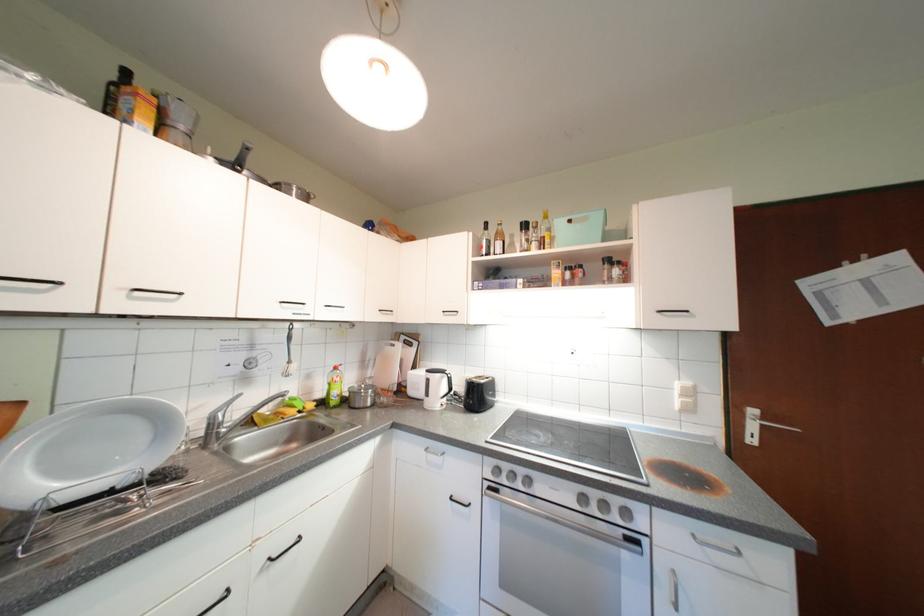
Which object does [9,415] point to?

It refers to a orange cardboard box.